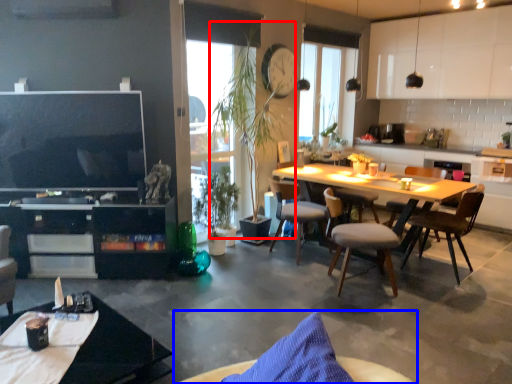
Question: Which point is closer to the camera, plant (highlighted by a red box) or chair (highlighted by a blue box)?

Choices:
 (A) plant
 (B) chair

Answer: (B)